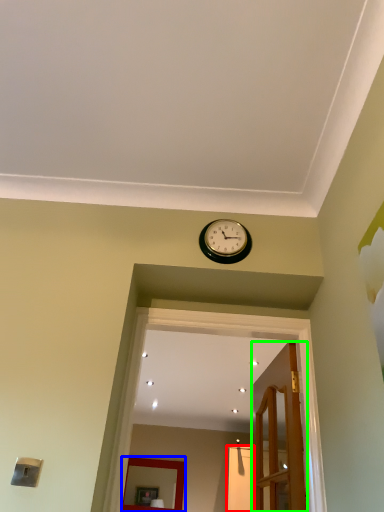
Question: Considering the real-world distances, which object is closest to glass door (highlighted by a red box)? mirror (highlighted by a blue box) or door (highlighted by a green box).

Choices:
 (A) mirror
 (B) door

Answer: (A)